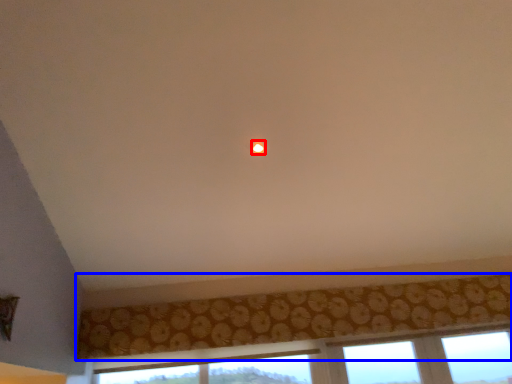
Question: Among these objects, which one is farthest to the camera, glow (highlighted by a red box) or curtain (highlighted by a blue box)?

Choices:
 (A) glow
 (B) curtain

Answer: (B)